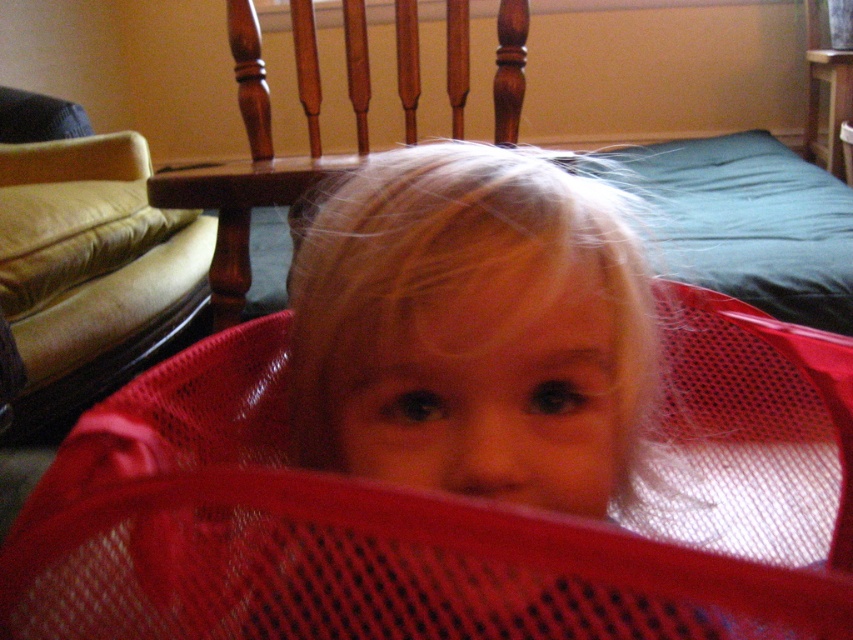
Is matte plastic basket at center bigger than wooden chair at center?

Actually, matte plastic basket at center might be smaller than wooden chair at center.

Can you confirm if matte plastic basket at center is smaller than wooden chair at center?

Yes, matte plastic basket at center is smaller than wooden chair at center.

Who is more distant from viewer, [310,308] or [503,54]?

Positioned behind is point [503,54].

The image size is (853, 640). What are the coordinates of `matte plastic basket at center` in the screenshot? It's located at 473,330.

Is red mesh basket at center shorter than beige fabric couch at left?

Yes.

Who is higher up, red mesh basket at center or beige fabric couch at left?

Positioned higher is beige fabric couch at left.

What do you see at coordinates (444, 512) in the screenshot? I see `red mesh basket at center` at bounding box center [444, 512].

At what (x,y) coordinates should I click in order to perform the action: click on red mesh basket at center. Please return your answer as a coordinate pair (x, y). This screenshot has width=853, height=640. Looking at the image, I should click on (444, 512).

In order to click on beige fabric couch at left in this screenshot , I will do `click(84, 260)`.

Is beige fabric couch at left taller than wooden chair at center?

Correct, beige fabric couch at left is much taller as wooden chair at center.

Does point (144, 189) come farther from viewer compared to point (410, 84)?

No, (144, 189) is closer to viewer.

Identify the location of beige fabric couch at left. This screenshot has width=853, height=640. (84, 260).